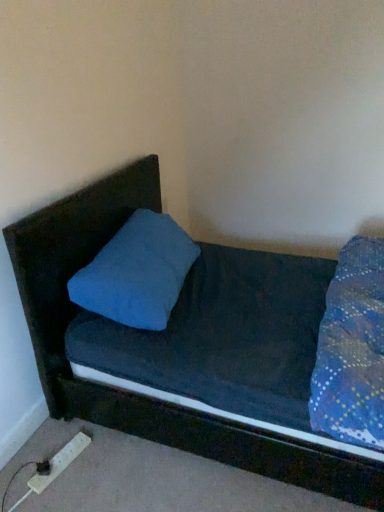
Find the location of a particular element. This screenshot has width=384, height=512. dark blue fabric bed at center is located at coordinates (187, 343).

Describe the element at coordinates (187, 343) in the screenshot. I see `dark blue fabric bed at center` at that location.

The height and width of the screenshot is (512, 384). What are the coordinates of `dark blue fabric bed at center` in the screenshot? It's located at (187, 343).